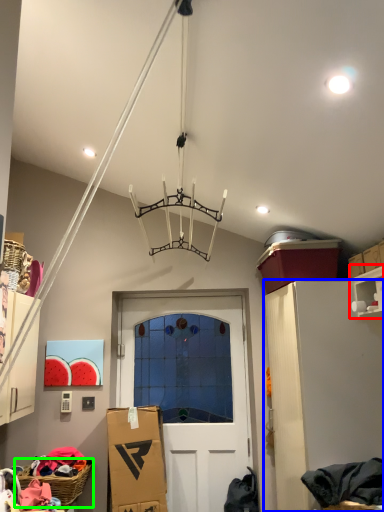
Question: Based on their relative distances, which object is farther from shelf (highlighted by a red box)? Choose from cabinetry (highlighted by a blue box) and basket (highlighted by a green box).

Choices:
 (A) cabinetry
 (B) basket

Answer: (B)